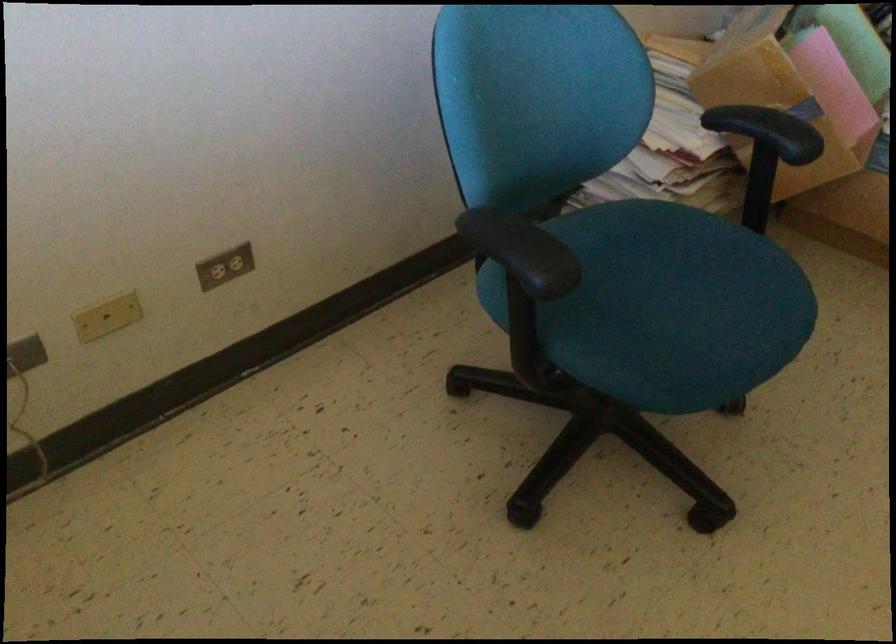
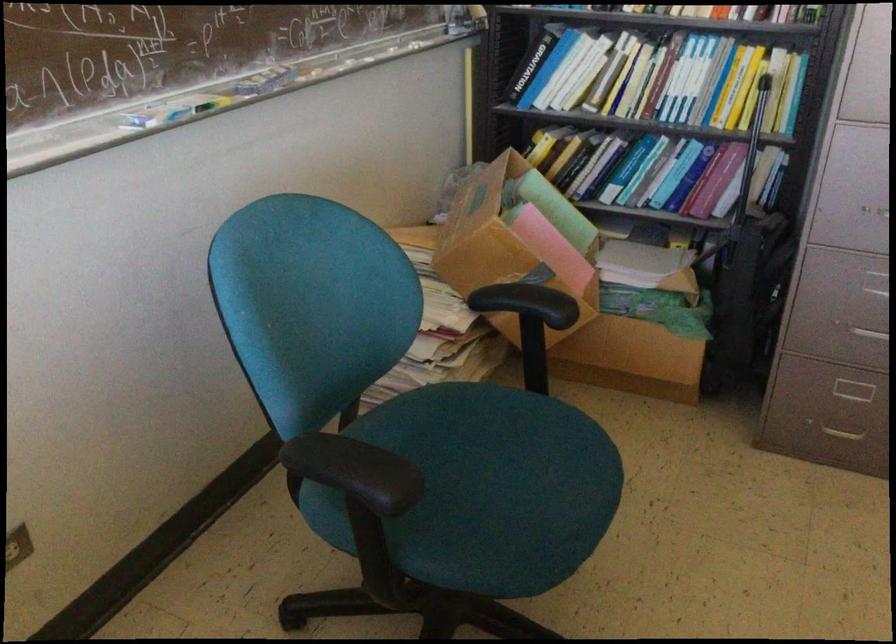
Find the pixel in the second image that matches (x=519, y=245) in the first image.

(356, 471)